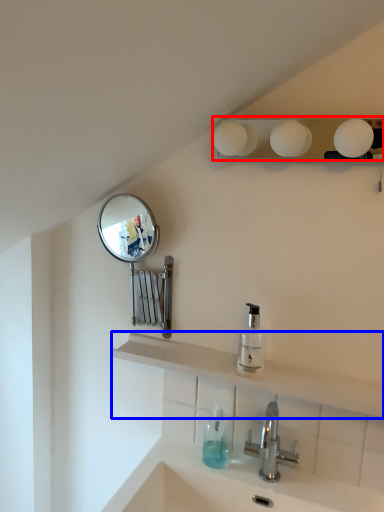
Question: Which of the following is the closest to the observer, lighting (highlighted by a red box) or shelve (highlighted by a blue box)?

Choices:
 (A) lighting
 (B) shelve

Answer: (A)